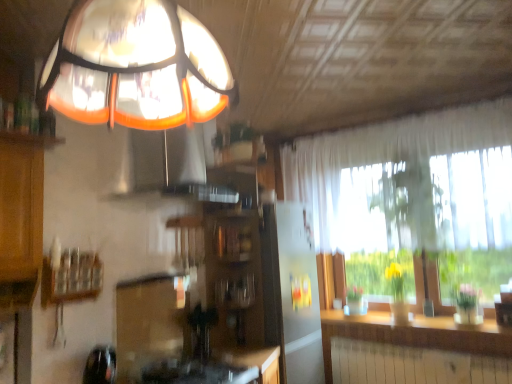
Question: Considering the relative positions of translucent glass lampshade at upper center and orange glass exhaust hood at upper center in the image provided, is translucent glass lampshade at upper center to the left or to the right of orange glass exhaust hood at upper center?

Choices:
 (A) right
 (B) left

Answer: (A)

Question: Is translucent glass lampshade at upper center inside the boundaries of orange glass exhaust hood at upper center, or outside?

Choices:
 (A) inside
 (B) outside

Answer: (B)

Question: Which is nearer to the translucent white curtain at right?

Choices:
 (A) wooden shelf at left
 (B) orange glass exhaust hood at upper center
 (C) translucent glass lampshade at upper center
 (D) wooden cabinet at center
 (E) wooden counter top at lower right

Answer: (D)

Question: Based on their relative distances, which object is nearer to the wooden cabinet at center?

Choices:
 (A) translucent white curtain at right
 (B) translucent glass lampshade at upper center
 (C) wooden counter top at lower right
 (D) wooden shelf at left
 (E) orange glass exhaust hood at upper center

Answer: (E)